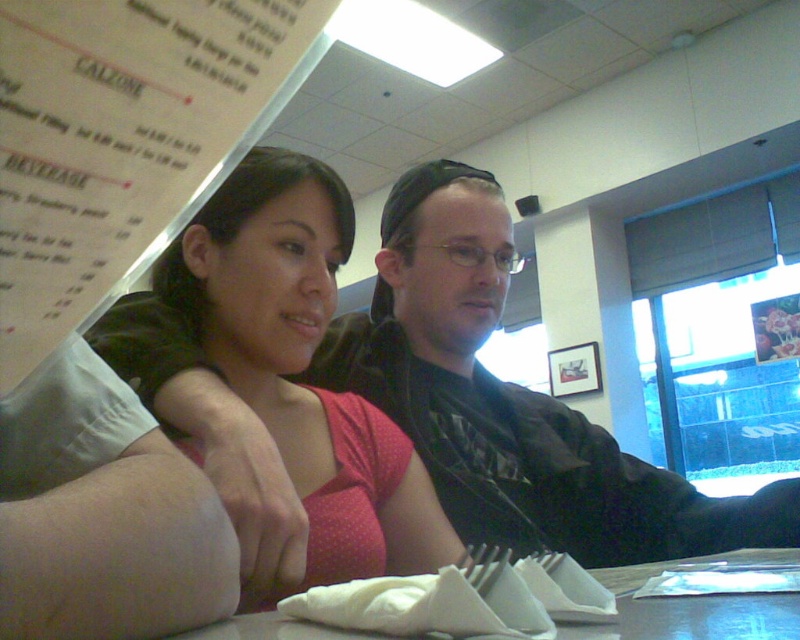
Question: Among these objects, which one is farthest from the camera?

Choices:
 (A) white paper menu at upper left
 (B) pink dotted fabric at center
 (C) white paper napkin at lower center

Answer: (B)

Question: Does pink dotted fabric at center have a larger size compared to white paper napkin at lower center?

Choices:
 (A) yes
 (B) no

Answer: (A)

Question: Which of these objects is positioned farthest from the white paper napkin at lower center?

Choices:
 (A) white paper menu at upper left
 (B) pink dotted fabric at center

Answer: (A)

Question: Is white paper menu at upper left in front of white paper napkin at lower center?

Choices:
 (A) no
 (B) yes

Answer: (B)

Question: Which point is closer to the camera?

Choices:
 (A) (316, 513)
 (B) (710, 609)
 (C) (196, 129)

Answer: (C)

Question: Is pink dotted fabric at center wider than white paper napkin at lower center?

Choices:
 (A) no
 (B) yes

Answer: (A)